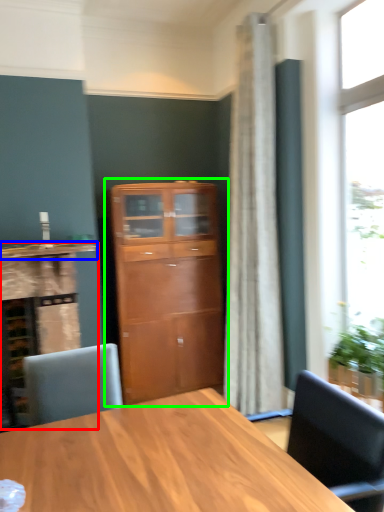
Question: Based on their relative distances, which object is farther from cabinetry (highlighted by a red box)? Choose from counter top (highlighted by a blue box) and cupboard (highlighted by a green box).

Choices:
 (A) counter top
 (B) cupboard

Answer: (B)